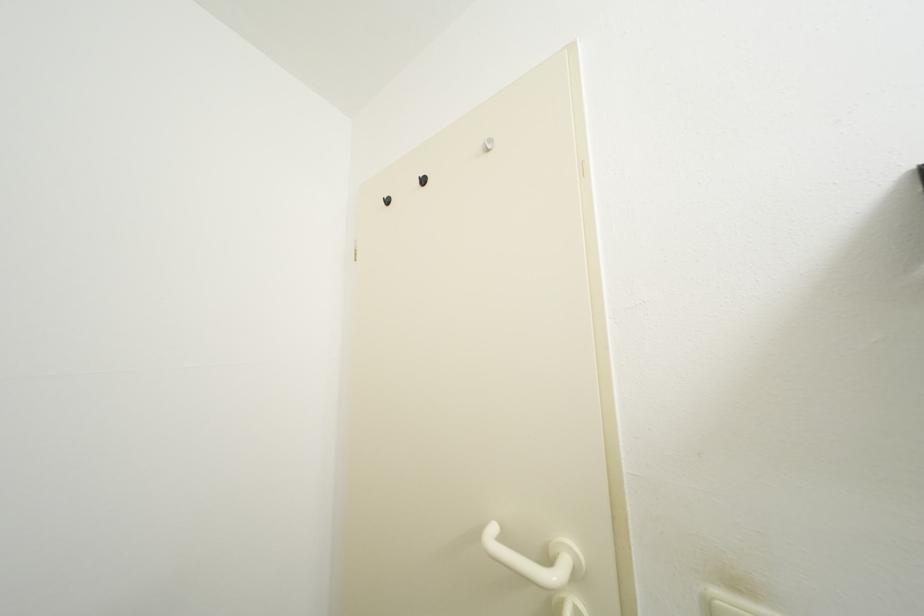
Locate an element on the screen. white door hook is located at coordinates (566, 605).